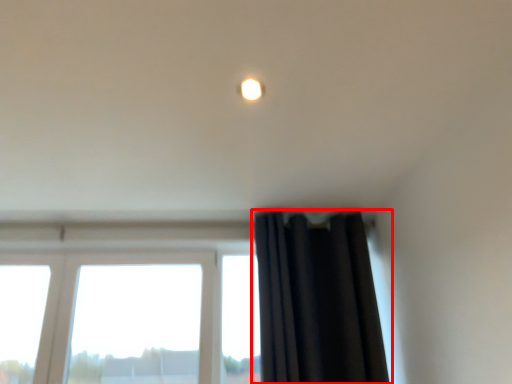
Question: Where is curtain (annotated by the red box) located in relation to lighting in the image?

Choices:
 (A) left
 (B) right

Answer: (B)